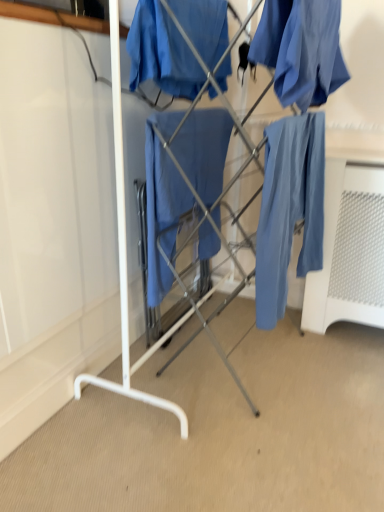
I want to click on free space below matte blue pants at right (from a real-world perspective), so [288, 366].